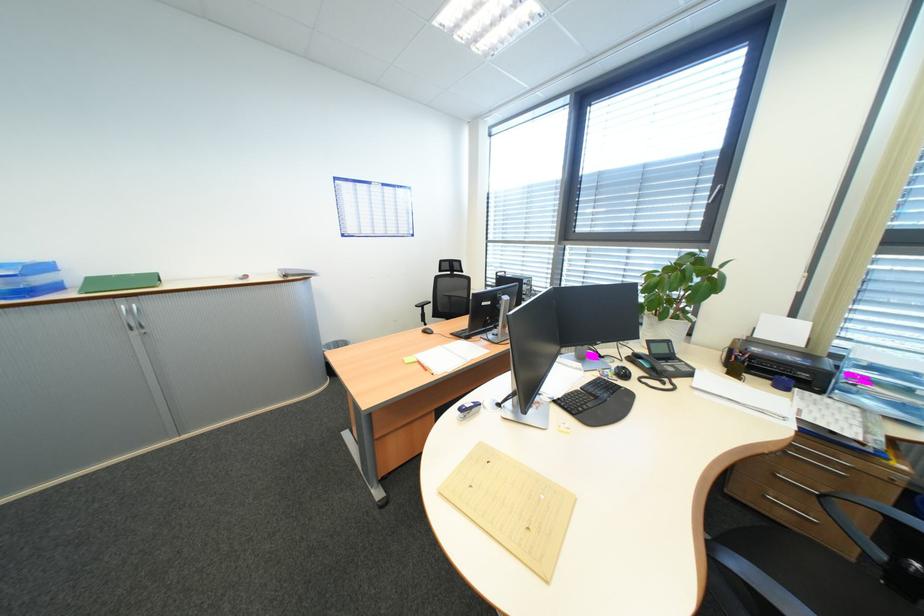
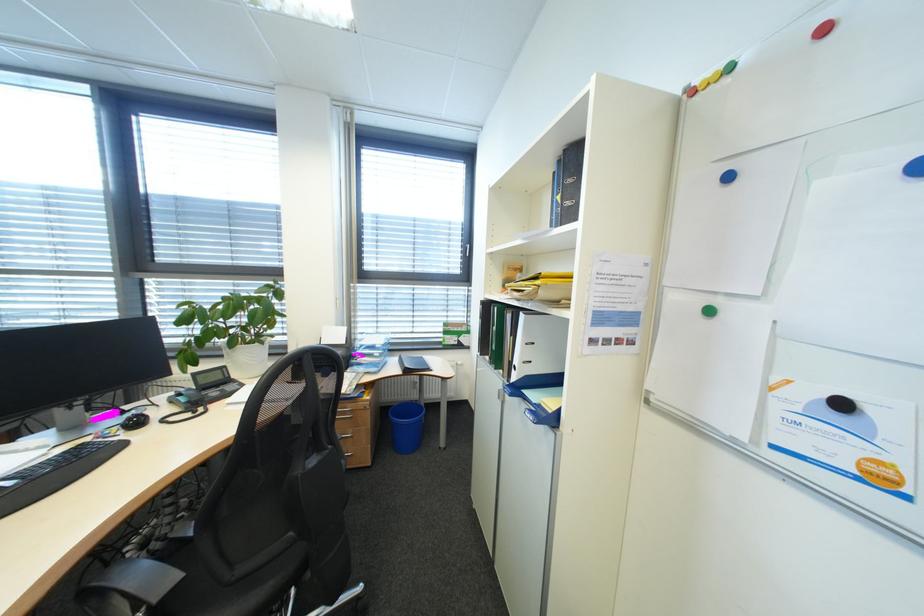
Question: The camera is either moving clockwise (left) or counter-clockwise (right) around the object. The first image is from the beginning of the video and the second image is from the end. Is the camera moving left or right when shooting the video?

Choices:
 (A) Left
 (B) Right

Answer: (A)